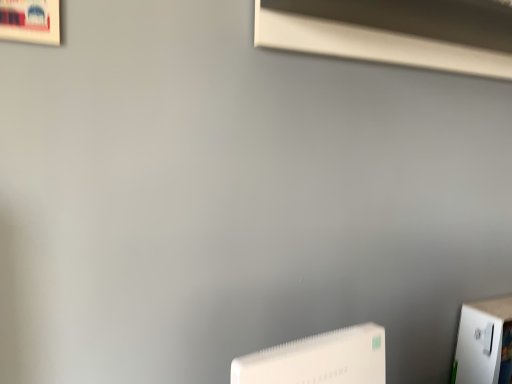
Image resolution: width=512 pixels, height=384 pixels. Describe the element at coordinates (318, 359) in the screenshot. I see `white plastic wii at lower center` at that location.

Locate an element on the screen. white plastic wii at lower center is located at coordinates (318, 359).

In order to face white plastic wii at lower center, should I rotate leftwards or rightwards?

Turn right by 7.439 degrees to look at white plastic wii at lower center.

This screenshot has width=512, height=384. What do you see at coordinates (394, 32) in the screenshot? I see `white smooth window sill at upper center` at bounding box center [394, 32].

In order to face white smooth window sill at upper center, should I rotate leftwards or rightwards?

Turn right by 24.774 degrees to look at white smooth window sill at upper center.

Where is `white smooth window sill at upper center`? white smooth window sill at upper center is located at coordinates (394, 32).

This screenshot has height=384, width=512. In order to click on white plastic wii at lower center in this screenshot , I will do `click(318, 359)`.

In the scene shown: Can you confirm if white plastic wii at lower center is positioned to the right of white smooth window sill at upper center?

No.

Looking at this image, is white plastic wii at lower center positioned before white smooth window sill at upper center?

Yes, the depth of white plastic wii at lower center is less than that of white smooth window sill at upper center.

Considering the points (359, 370) and (328, 10), which point is behind, point (359, 370) or point (328, 10)?

Positioned behind is point (328, 10).

From the image's perspective, which one is positioned higher, white plastic wii at lower center or white smooth window sill at upper center?

From the image's view, white smooth window sill at upper center is above.

From a real-world perspective, is white plastic wii at lower center positioned under white smooth window sill at upper center based on gravity?

Correct, in the physical world, white plastic wii at lower center is lower than white smooth window sill at upper center.

In terms of width, does white plastic wii at lower center look wider or thinner when compared to white smooth window sill at upper center?

Clearly, white plastic wii at lower center has less width compared to white smooth window sill at upper center.

Considering the sizes of white plastic wii at lower center and white smooth window sill at upper center in the image, is white plastic wii at lower center taller or shorter than white smooth window sill at upper center?

white plastic wii at lower center is taller than white smooth window sill at upper center.

Between white plastic wii at lower center and white smooth window sill at upper center, which one has smaller size?

Smaller between the two is white plastic wii at lower center.

Is white plastic wii at lower center not within white smooth window sill at upper center?

Yes, white plastic wii at lower center is outside of white smooth window sill at upper center.

Is white plastic wii at lower center not close to white smooth window sill at upper center?

No.

Consider the image. Could you tell me if white plastic wii at lower center is turned towards white smooth window sill at upper center?

No.

How many degrees apart are the facing directions of white plastic wii at lower center and white smooth window sill at upper center?

1.68 degrees.

In the scene shown: Measure the distance from white plastic wii at lower center to white smooth window sill at upper center.

white plastic wii at lower center is 22.74 inches from white smooth window sill at upper center.

At what (x,y) coordinates should I click in order to perform the action: click on window sill above the white plastic wii at lower center (from the image's perspective). Please return your answer as a coordinate pair (x, y). The image size is (512, 384). Looking at the image, I should click on (394, 32).

Based on their positions, is white smooth window sill at upper center located to the left or right of white plastic wii at lower center?

white smooth window sill at upper center is positioned on white plastic wii at lower center's right side.

Considering the positions of objects white smooth window sill at upper center and white plastic wii at lower center in the image provided, who is behind, white smooth window sill at upper center or white plastic wii at lower center?

white smooth window sill at upper center is more distant.

Considering the positions of points (438, 55) and (268, 367), is point (438, 55) closer to camera compared to point (268, 367)?

No, (438, 55) is behind (268, 367).

From the image's perspective, who appears lower, white smooth window sill at upper center or white plastic wii at lower center?

white plastic wii at lower center appears lower in the image.

From a real-world perspective, between white smooth window sill at upper center and white plastic wii at lower center, who is vertically higher?

From a 3D spatial view, white smooth window sill at upper center is above.

In terms of width, does white smooth window sill at upper center look wider or thinner when compared to white plastic wii at lower center?

Considering their sizes, white smooth window sill at upper center looks broader than white plastic wii at lower center.

Considering the sizes of objects white smooth window sill at upper center and white plastic wii at lower center in the image provided, who is taller, white smooth window sill at upper center or white plastic wii at lower center?

white plastic wii at lower center.

Which of these two, white smooth window sill at upper center or white plastic wii at lower center, is smaller?

white plastic wii at lower center is smaller.

Is white smooth window sill at upper center positioned beyond the bounds of white plastic wii at lower center?

Indeed, white smooth window sill at upper center is completely outside white plastic wii at lower center.

Are white smooth window sill at upper center and white plastic wii at lower center far apart?

They are positioned close to each other.

Is white smooth window sill at upper center facing away from white plastic wii at lower center?

No, white plastic wii at lower center is not at the back of white smooth window sill at upper center.

You are a GUI agent. You are given a task and a screenshot of the screen. Output one action in this format:
    pyautogui.click(x=<x>, y=<y>)
    Task: Click on the Wii located on the left of white smooth window sill at upper center
    This screenshot has width=512, height=384.
    Given the screenshot: What is the action you would take?
    pyautogui.click(x=318, y=359)

Find the location of a particular element. This screenshot has height=384, width=512. Wii below the white smooth window sill at upper center (from a real-world perspective) is located at coordinates [318, 359].

Where is `window sill behind the white plastic wii at lower center`? This screenshot has height=384, width=512. window sill behind the white plastic wii at lower center is located at coordinates (394, 32).